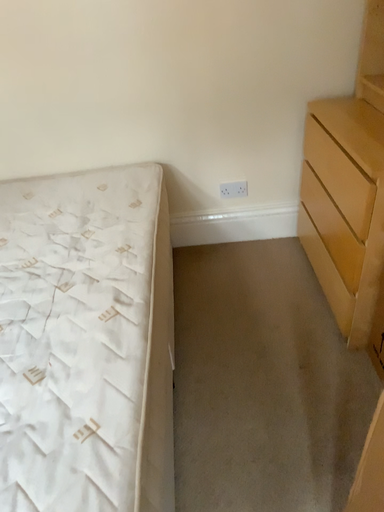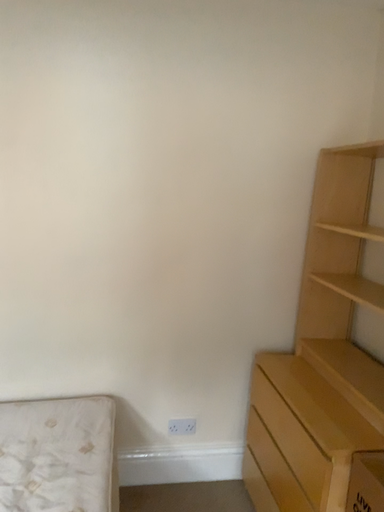
Question: How did the camera likely rotate when shooting the video?

Choices:
 (A) rotated left
 (B) rotated right

Answer: (B)